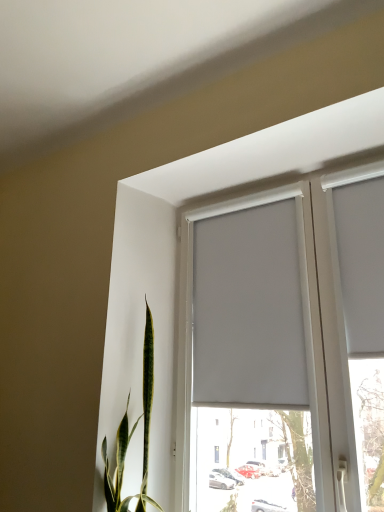
The width and height of the screenshot is (384, 512). What are the coordinates of `white matte curtain at upper center, the first curtain positioned from the left` in the screenshot? It's located at (249, 310).

The height and width of the screenshot is (512, 384). What do you see at coordinates (361, 262) in the screenshot? I see `white matte curtain at upper right, which is counted as the second curtain, starting from the left` at bounding box center [361, 262].

Find the location of a particular element. white matte curtain at upper right, which is counted as the second curtain, starting from the left is located at coordinates (361, 262).

At what (x,y) coordinates should I click in order to perform the action: click on white matte curtain at upper center, the 2th curtain from the right. Please return your answer as a coordinate pair (x, y). Looking at the image, I should click on (249, 310).

From the image's perspective, is white matte curtain at upper center, the 2th curtain from the right, beneath white matte curtain at upper right, which is counted as the second curtain, starting from the left?

Yes.

Based on the photo, which is correct: white matte curtain at upper center, the first curtain positioned from the left, is inside white matte curtain at upper right, which is counted as the second curtain, starting from the left, or outside of it?

white matte curtain at upper center, the first curtain positioned from the left, exists outside the volume of white matte curtain at upper right, which is counted as the second curtain, starting from the left.

Which of these two, white matte curtain at upper center, the 2th curtain from the right, or white matte curtain at upper right, which is counted as the second curtain, starting from the left, is wider?

white matte curtain at upper center, the 2th curtain from the right.

Based on the photo, is white matte curtain at upper center, the first curtain positioned from the left, smaller than white matte curtain at upper right, the 1th curtain when ordered from right to left?

No.

From the image's perspective, would you say white matte curtain at upper right, the 1th curtain when ordered from right to left, is shown under white matte window at center?

No.

Is white matte curtain at upper right, the 1th curtain when ordered from right to left, aimed at white matte window at center?

Yes, white matte curtain at upper right, the 1th curtain when ordered from right to left, is oriented towards white matte window at center.

Considering the positions of points (365, 195) and (292, 151), is point (365, 195) farther from camera compared to point (292, 151)?

No, (365, 195) is closer to viewer.

Is white matte curtain at upper right, the 1th curtain when ordered from right to left, not inside white matte window at center?

No, white matte curtain at upper right, the 1th curtain when ordered from right to left, is not outside of white matte window at center.

Does white matte window at center turn towards white matte curtain at upper center, the 2th curtain from the right?

Yes, white matte window at center is oriented towards white matte curtain at upper center, the 2th curtain from the right.

Is white matte window at center touching white matte curtain at upper center, the 2th curtain from the right?

No, white matte window at center is not next to white matte curtain at upper center, the 2th curtain from the right.

Considering the sizes of objects white matte curtain at upper right, which is counted as the second curtain, starting from the left, and white matte curtain at upper center, the first curtain positioned from the left, in the image provided, who is bigger, white matte curtain at upper right, which is counted as the second curtain, starting from the left, or white matte curtain at upper center, the first curtain positioned from the left,?

white matte curtain at upper center, the first curtain positioned from the left.

Can we say white matte curtain at upper right, the 1th curtain when ordered from right to left, lies outside white matte curtain at upper center, the first curtain positioned from the left?

Yes.

From the image's perspective, which one is positioned lower, white matte curtain at upper right, which is counted as the second curtain, starting from the left, or white matte curtain at upper center, the 2th curtain from the right?

white matte curtain at upper center, the 2th curtain from the right, appears lower in the image.

Which is further, (x=160, y=479) or (x=357, y=349)?

The point (x=160, y=479) is farther from the camera.

Which curtain is the 1st one when counting from the back of the white matte window at center? Please provide its 2D coordinates.

[(361, 262)]

How many degrees apart are the facing directions of white matte window at center and white matte curtain at upper right, which is counted as the second curtain, starting from the left?

1.81 degrees.

Based on the photo, from the image's perspective, which object appears higher, white matte window at center or white matte curtain at upper right, which is counted as the second curtain, starting from the left?

white matte curtain at upper right, which is counted as the second curtain, starting from the left, appears higher in the image.

Considering their positions, is white matte curtain at upper center, the first curtain positioned from the left, located in front of or behind white matte window at center?

Clearly, white matte curtain at upper center, the first curtain positioned from the left, is behind white matte window at center.

Can you confirm if white matte curtain at upper center, the first curtain positioned from the left, is bigger than white matte window at center?

No, white matte curtain at upper center, the first curtain positioned from the left, is not bigger than white matte window at center.

From a real-world perspective, which is physically below, white matte curtain at upper center, the first curtain positioned from the left, or white matte window at center?

From a 3D spatial view, white matte window at center is below.

How many degrees apart are the facing directions of white matte curtain at upper center, the first curtain positioned from the left, and white matte window at center?

The angle between the facing direction of white matte curtain at upper center, the first curtain positioned from the left, and the facing direction of white matte window at center is 0.0144 degrees.

Locate an element on the screen. Image resolution: width=384 pixels, height=512 pixels. curtain above the white matte curtain at upper center, the first curtain positioned from the left (from a real-world perspective) is located at coordinates (361, 262).

This screenshot has width=384, height=512. I want to click on curtain to the right of white matte window at center, so click(361, 262).

From the image, which object appears to be farther from white matte curtain at upper right, the 1th curtain when ordered from right to left, white matte window at center or white matte curtain at upper center, the first curtain positioned from the left?

white matte window at center.

Based on their spatial positions, is white matte window at center or white matte curtain at upper right, the 1th curtain when ordered from right to left, closer to white matte curtain at upper center, the first curtain positioned from the left?

white matte window at center is closer to white matte curtain at upper center, the first curtain positioned from the left.

Considering their positions, is white matte curtain at upper center, the first curtain positioned from the left, positioned further to white matte curtain at upper right, the 1th curtain when ordered from right to left, than white matte window at center?

The object further to white matte curtain at upper right, the 1th curtain when ordered from right to left, is white matte window at center.

When comparing their distances from white matte curtain at upper center, the first curtain positioned from the left, does white matte curtain at upper right, the 1th curtain when ordered from right to left, or white matte window at center seem further?

The object further to white matte curtain at upper center, the first curtain positioned from the left, is white matte curtain at upper right, the 1th curtain when ordered from right to left.

Looking at the image, which one is located closer to white matte window at center, white matte curtain at upper center, the first curtain positioned from the left, or white matte curtain at upper right, the 1th curtain when ordered from right to left?

Based on the image, white matte curtain at upper center, the first curtain positioned from the left, appears to be nearer to white matte window at center.

Looking at the image, which one is located closer to white matte window at center, white matte curtain at upper right, the 1th curtain when ordered from right to left, or white matte curtain at upper center, the 2th curtain from the right?

Among the two, white matte curtain at upper center, the 2th curtain from the right, is located nearer to white matte window at center.

Image resolution: width=384 pixels, height=512 pixels. I want to click on window situated between white matte curtain at upper center, the first curtain positioned from the left, and white matte curtain at upper right, which is counted as the second curtain, starting from the left, from left to right, so click(176, 242).